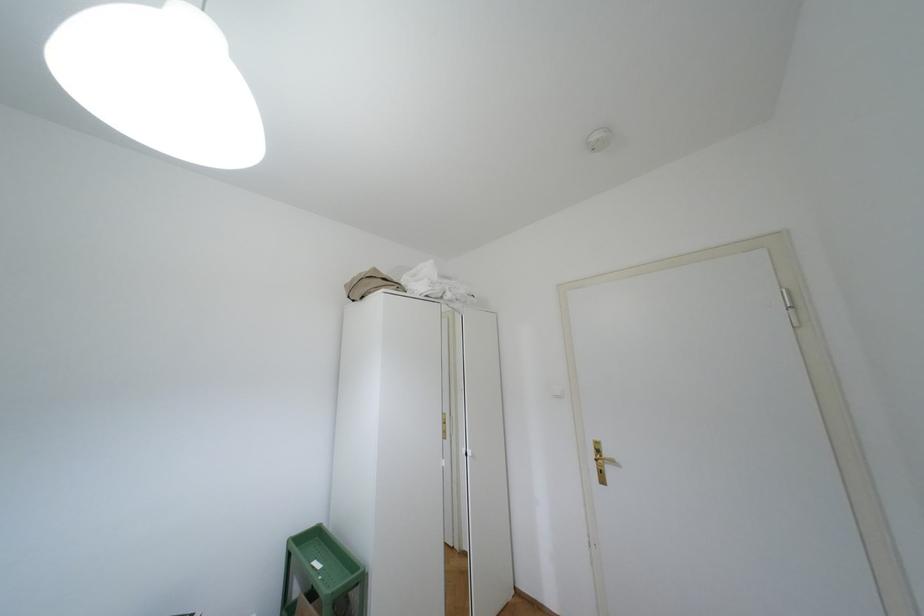
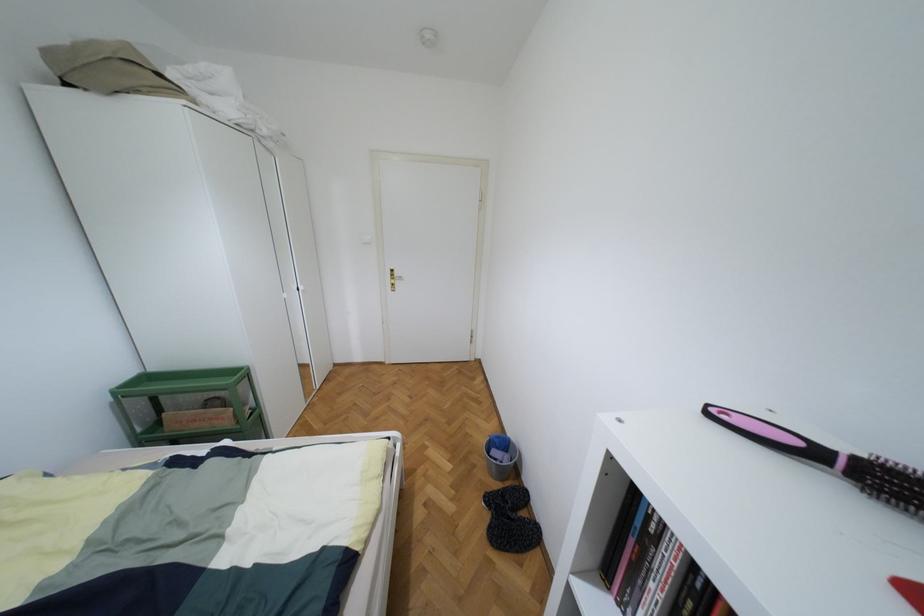
How did the camera likely rotate?

The camera rotated toward right-down.